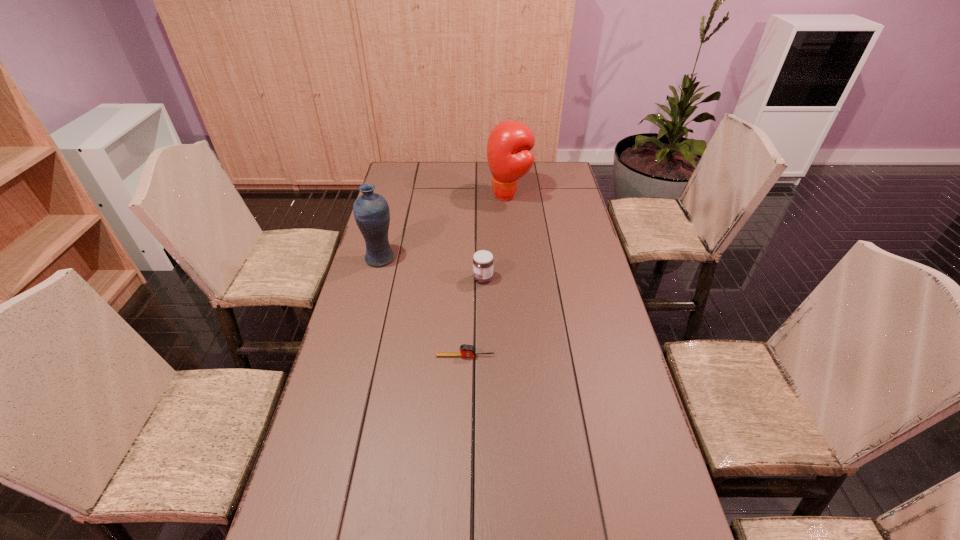
Select which object is the second closest to the tape measure. Please provide its 2D coordinates. Your answer should be formatted as a tuple, i.e. [(x, y)], where the tuple contains the x and y coordinates of a point satisfying the conditions above.

[(371, 211)]

Point out which object is positioned as the second nearest to the leftmost object. Please provide its 2D coordinates. Your answer should be formatted as a tuple, i.e. [(x, y)], where the tuple contains the x and y coordinates of a point satisfying the conditions above.

[(465, 350)]